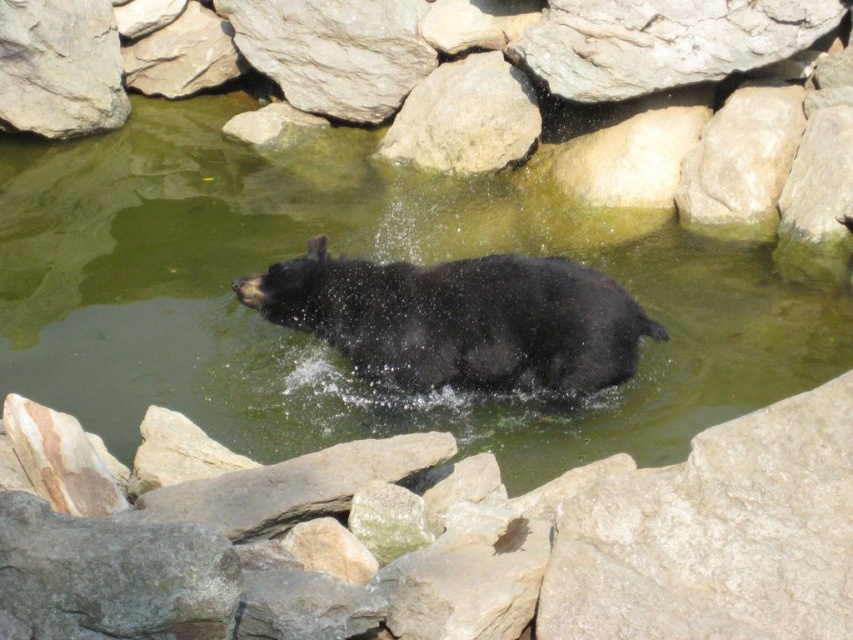
Question: Considering the relative positions of green liquid water at center and black matte bear at center in the image provided, where is green liquid water at center located with respect to black matte bear at center?

Choices:
 (A) right
 (B) left

Answer: (B)

Question: Is gray rough rock at lower right wider than black matte bear at center?

Choices:
 (A) yes
 (B) no

Answer: (B)

Question: Which of the following is the farthest from the observer?

Choices:
 (A) (231, 266)
 (B) (294, 292)

Answer: (A)

Question: Does gray rough rock at lower right appear under smooth gray rock at upper center?

Choices:
 (A) yes
 (B) no

Answer: (A)

Question: Which point appears closest to the camera in this image?

Choices:
 (A) (554, 266)
 (B) (799, 566)
 (C) (149, 356)

Answer: (B)

Question: Which point appears closest to the camera in this image?

Choices:
 (A) (67, 35)
 (B) (654, 476)

Answer: (B)